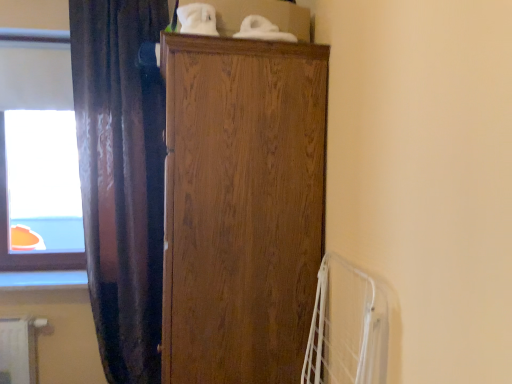
Question: Can you confirm if wooden cabinet at center is shorter than transparent glass window at upper left?

Choices:
 (A) no
 (B) yes

Answer: (A)

Question: Does wooden cabinet at center appear on the right side of transparent glass window at upper left?

Choices:
 (A) yes
 (B) no

Answer: (A)

Question: Is wooden cabinet at center positioned in front of transparent glass window at upper left?

Choices:
 (A) no
 (B) yes

Answer: (B)

Question: From the image's perspective, is wooden cabinet at center under transparent glass window at upper left?

Choices:
 (A) no
 (B) yes

Answer: (B)

Question: Is there a large distance between wooden cabinet at center and transparent glass window at upper left?

Choices:
 (A) yes
 (B) no

Answer: (A)

Question: In the image, is wooden cabinet at center positioned in front of or behind dark velvet curtain at left?

Choices:
 (A) front
 (B) behind

Answer: (A)

Question: Considering the positions of wooden cabinet at center and dark velvet curtain at left in the image, is wooden cabinet at center wider or thinner than dark velvet curtain at left?

Choices:
 (A) thin
 (B) wide

Answer: (B)

Question: Is point (311, 215) closer or farther from the camera than point (155, 309)?

Choices:
 (A) farther
 (B) closer

Answer: (B)

Question: From a real-world perspective, relative to dark velvet curtain at left, is wooden cabinet at center vertically above or below?

Choices:
 (A) below
 (B) above

Answer: (A)

Question: From the image's perspective, is dark velvet curtain at left located above or below transparent glass window at upper left?

Choices:
 (A) above
 (B) below

Answer: (B)

Question: From a real-world perspective, is dark velvet curtain at left physically located above or below transparent glass window at upper left?

Choices:
 (A) above
 (B) below

Answer: (B)

Question: In the image, is dark velvet curtain at left on the left side or the right side of transparent glass window at upper left?

Choices:
 (A) left
 (B) right

Answer: (B)

Question: Is dark velvet curtain at left wider or thinner than transparent glass window at upper left?

Choices:
 (A) thin
 (B) wide

Answer: (B)

Question: Considering the positions of dark velvet curtain at left and wooden cabinet at center in the image, is dark velvet curtain at left taller or shorter than wooden cabinet at center?

Choices:
 (A) tall
 (B) short

Answer: (A)

Question: Considering the positions of dark velvet curtain at left and wooden cabinet at center in the image, is dark velvet curtain at left bigger or smaller than wooden cabinet at center?

Choices:
 (A) small
 (B) big

Answer: (A)